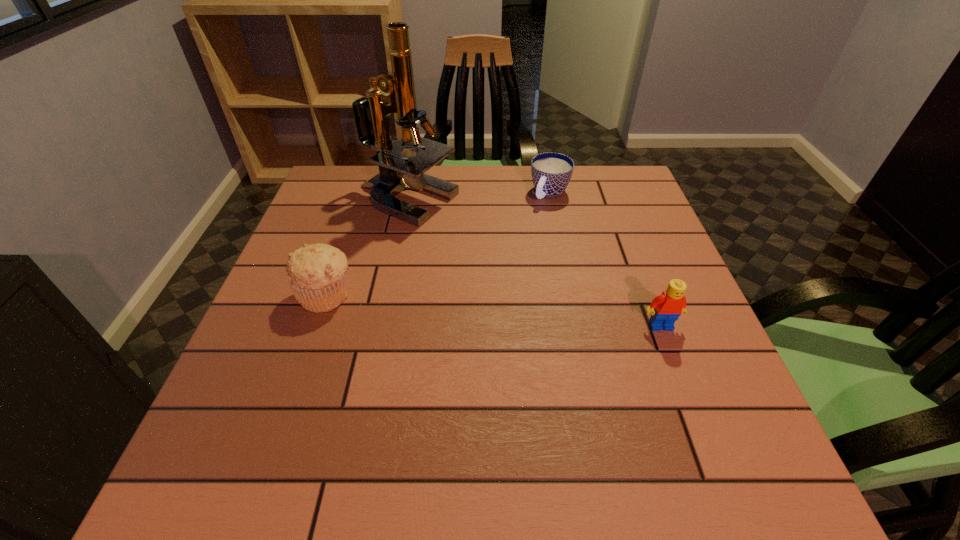
Identify the location of muffin. The height and width of the screenshot is (540, 960). (317, 273).

You are a GUI agent. You are given a task and a screenshot of the screen. Output one action in this format:
    pyautogui.click(x=<x>, y=<y>)
    Task: Click on the Lego
    The width and height of the screenshot is (960, 540).
    Given the screenshot: What is the action you would take?
    pyautogui.click(x=665, y=309)

At what (x,y) coordinates should I click in order to perform the action: click on the nearest object. Please return your answer as a coordinate pair (x, y). The height and width of the screenshot is (540, 960). Looking at the image, I should click on (665, 309).

Find the location of `cup`. cup is located at coordinates (551, 172).

At what (x,y) coordinates should I click in order to perform the action: click on the shortest object. Please return your answer as a coordinate pair (x, y). The height and width of the screenshot is (540, 960). Looking at the image, I should click on (551, 172).

The image size is (960, 540). I want to click on the tallest object, so click(397, 172).

Locate an element on the screen. vacant space located 0.400m on the back of the muffin is located at coordinates (366, 181).

Locate an element on the screen. The image size is (960, 540). free spot located on the face of the Lego is located at coordinates point(684,388).

Image resolution: width=960 pixels, height=540 pixels. Find the location of `free location located on the side of the cup with the handle`. free location located on the side of the cup with the handle is located at coordinates (483, 287).

Find the location of a particular element. This screenshot has height=540, width=960. vacant space situated on the side of the cup with the handle is located at coordinates (504, 258).